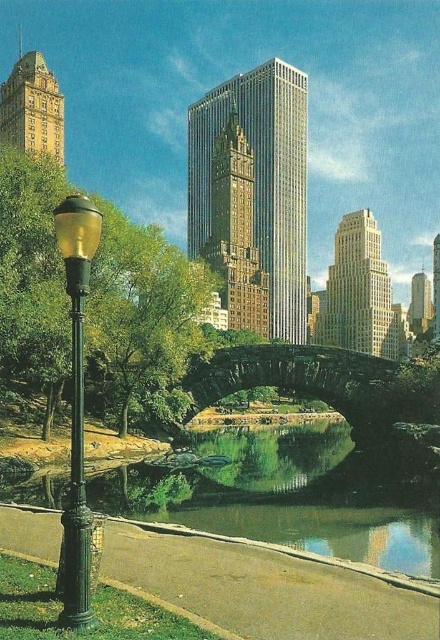
Question: Estimate the real-world distances between objects in this image. Which object is closer to the gold textured building at center?

Choices:
 (A) shiny silver skyscraper at right
 (B) beige stone skyscraper at center
 (C) gold/bronze building at upper left
 (D) stone textured bridge at center

Answer: (B)

Question: Does gold textured building at center have a greater width compared to gold/bronze building at upper left?

Choices:
 (A) yes
 (B) no

Answer: (B)

Question: Is green reflective water at center bigger than stone textured bridge at center?

Choices:
 (A) no
 (B) yes

Answer: (A)

Question: Estimate the real-world distances between objects in this image. Which object is closer to the stone textured bridge at center?

Choices:
 (A) gold textured building at center
 (B) gold/bronze building at upper left
 (C) shiny silver skyscraper at right
 (D) green polished metal street light at left

Answer: (D)

Question: Among these objects, which one is nearest to the camera?

Choices:
 (A) beige stone skyscraper at center
 (B) gold textured building at center
 (C) stone textured bridge at center

Answer: (C)

Question: Does green reflective water at center appear on the right side of shiny silver skyscraper at right?

Choices:
 (A) yes
 (B) no

Answer: (B)